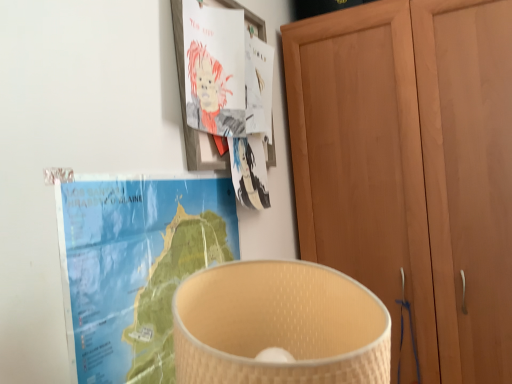
Question: From the image's perspective, relative to wooden cupboard at right, is blue paper map at upper left above or below?

Choices:
 (A) below
 (B) above

Answer: (A)

Question: Choose the correct answer: Is blue paper map at upper left inside wooden cupboard at right or outside it?

Choices:
 (A) inside
 (B) outside

Answer: (B)

Question: Considering the positions of blue paper map at upper left and wooden cupboard at right in the image, is blue paper map at upper left wider or thinner than wooden cupboard at right?

Choices:
 (A) thin
 (B) wide

Answer: (A)

Question: Considering their positions, is wooden cupboard at right located in front of or behind blue paper map at upper left?

Choices:
 (A) front
 (B) behind

Answer: (B)

Question: Does point (415, 332) appear closer or farther from the camera than point (117, 340)?

Choices:
 (A) closer
 (B) farther

Answer: (B)

Question: From a real-world perspective, is wooden cupboard at right above or below blue paper map at upper left?

Choices:
 (A) below
 (B) above

Answer: (A)

Question: Choose the correct answer: Is wooden cupboard at right inside blue paper map at upper left or outside it?

Choices:
 (A) outside
 (B) inside

Answer: (A)